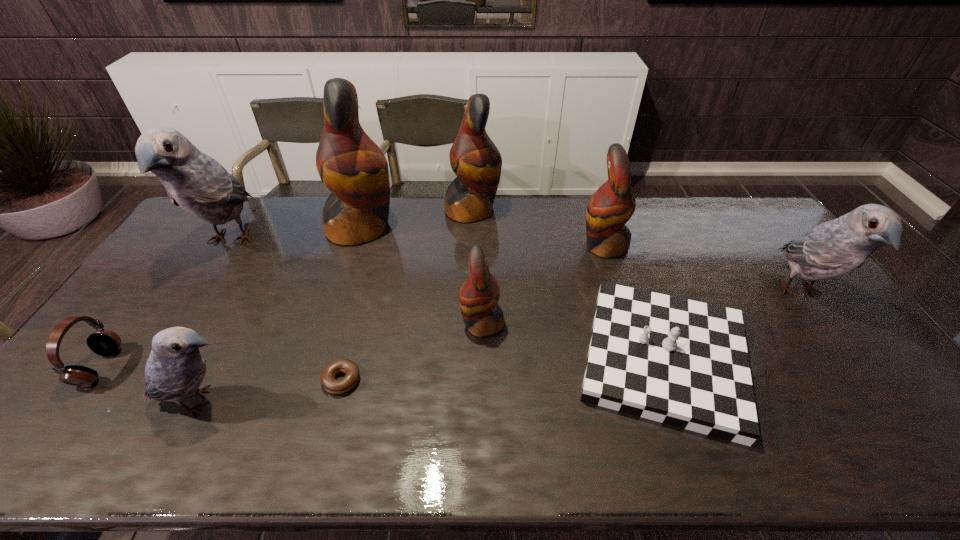
Where is `object that can be found as the third closest to the smallest red parrot`? The width and height of the screenshot is (960, 540). object that can be found as the third closest to the smallest red parrot is located at coordinates (610, 207).

Find the location of a particular element. the closest parrot to the black headset is located at coordinates (175, 369).

I want to click on parrot that is the second closest to the nearest red parrot, so click(x=350, y=164).

Identify which red parrot is the second closest to the shortest object. Please provide its 2D coordinates. Your answer should be formatted as a tuple, i.e. [(x, y)], where the tuple contains the x and y coordinates of a point satisfying the conditions above.

[(350, 164)]

Identify the location of red parrot that is the third closest to the fifth parrot from right to left. The image size is (960, 540). (610, 207).

The image size is (960, 540). What are the coordinates of `gray parrot that can be found as the third closest to the brown doughnut` in the screenshot? It's located at click(836, 247).

Locate an element on the screen. the third closest gray parrot relative to the headset is located at coordinates (836, 247).

Where is `vacant space that satisfies the following two spatial constraints: 1. on the front-facing side of the second biggest gray parrot; 2. on the front-facing side of the nearest gray parrot`? vacant space that satisfies the following two spatial constraints: 1. on the front-facing side of the second biggest gray parrot; 2. on the front-facing side of the nearest gray parrot is located at coordinates (878, 402).

At what (x,y) coordinates should I click in order to perform the action: click on free space that satisfies the following two spatial constraints: 1. on the face of the brown doughnut; 2. on the right side of the leftmost red parrot. Please return your answer as a coordinate pair (x, y). The height and width of the screenshot is (540, 960). Looking at the image, I should click on (314, 380).

The image size is (960, 540). Find the location of `free space that satisfies the following two spatial constraints: 1. on the front-facing side of the second biggest gray parrot; 2. on the front-facing side of the smallest gray parrot`. free space that satisfies the following two spatial constraints: 1. on the front-facing side of the second biggest gray parrot; 2. on the front-facing side of the smallest gray parrot is located at coordinates (878, 402).